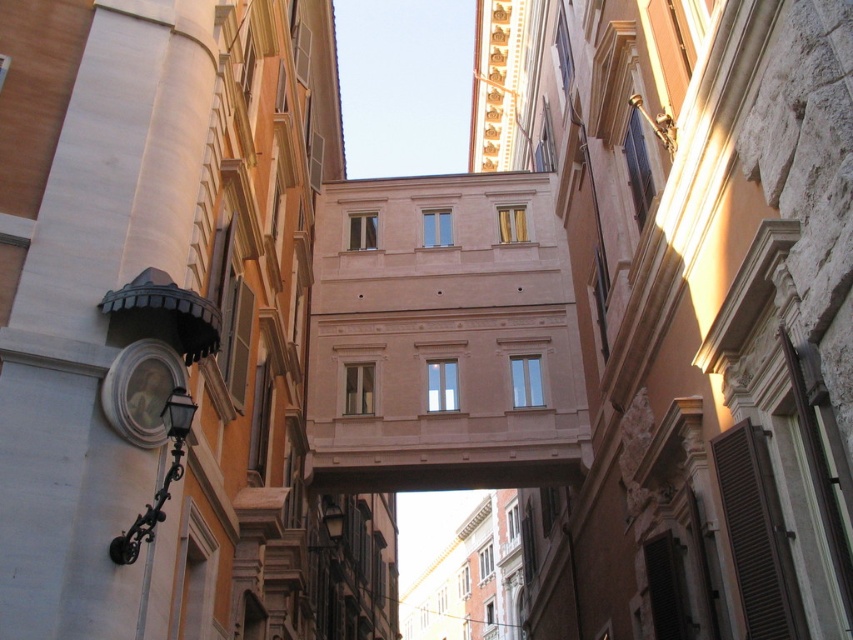
Is smooth stone wall at center in front of smooth beige building at center?

Yes, it is.

Does point (772, 440) come closer to viewer compared to point (387, 353)?

Yes, point (772, 440) is closer to viewer.

You are a GUI agent. You are given a task and a screenshot of the screen. Output one action in this format:
    pyautogui.click(x=<x>, y=<y>)
    Task: Click on the smooth stone wall at center
    The image size is (853, 640).
    Given the screenshot: What is the action you would take?
    pyautogui.click(x=701, y=317)